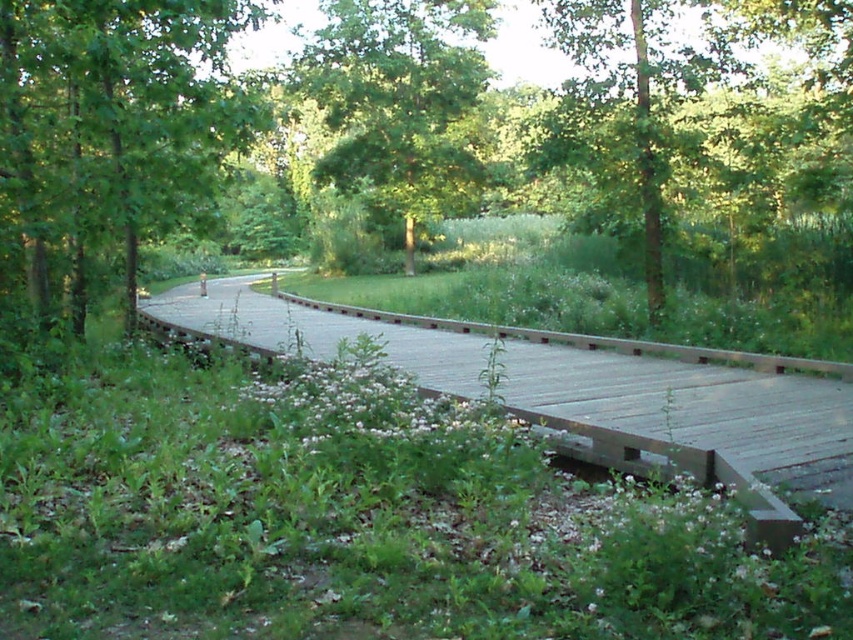
Question: Is the position of green matte tree at left more distant than that of green leafy tree at upper center?

Choices:
 (A) no
 (B) yes

Answer: (A)

Question: Which point is farther from the camera taking this photo?

Choices:
 (A) (734, 118)
 (B) (90, 92)
 (C) (450, 42)

Answer: (C)

Question: Considering the relative positions of wooden bridge at center and green leafy tree at upper center in the image provided, where is wooden bridge at center located with respect to green leafy tree at upper center?

Choices:
 (A) right
 (B) left

Answer: (B)

Question: Which of the following is the closest to the observer?

Choices:
 (A) wooden bridge at center
 (B) green leafy tree at upper center
 (C) green matte tree at left
 (D) green leafy tree at center

Answer: (A)

Question: Can you confirm if green matte tree at left is wider than green leafy tree at center?

Choices:
 (A) no
 (B) yes

Answer: (A)

Question: Which of these objects is positioned closest to the green matte tree at left?

Choices:
 (A) green leafy tree at center
 (B) green leafy tree at upper center

Answer: (B)